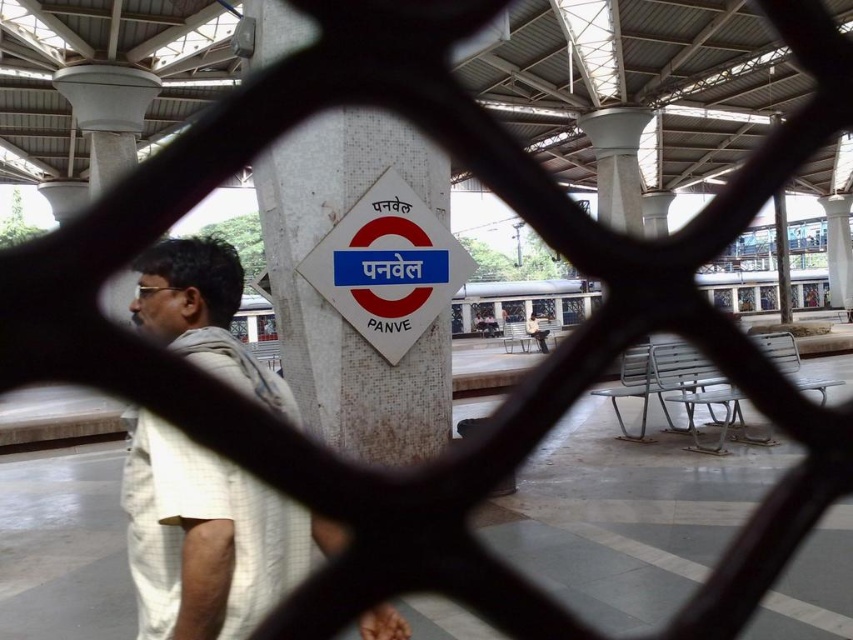
Question: Which point appears closest to the camera in this image?

Choices:
 (A) (323, 368)
 (B) (784, 273)

Answer: (A)

Question: Is white mosaic tile sign at center closer to camera compared to metallic pole at right?

Choices:
 (A) yes
 (B) no

Answer: (A)

Question: Can you confirm if white cotton shirt at left is positioned to the left of white plastic sign at center?

Choices:
 (A) yes
 (B) no

Answer: (A)

Question: Which of the following is the closest to the observer?

Choices:
 (A) (x=344, y=349)
 (B) (x=780, y=192)
 (C) (x=189, y=499)

Answer: (C)

Question: Among these objects, which one is farthest from the camera?

Choices:
 (A) white mosaic tile sign at center
 (B) white cotton shirt at left
 (C) metallic pole at right
 (D) white plastic sign at center

Answer: (C)

Question: Can you confirm if white plastic sign at center is thinner than metallic pole at right?

Choices:
 (A) yes
 (B) no

Answer: (A)